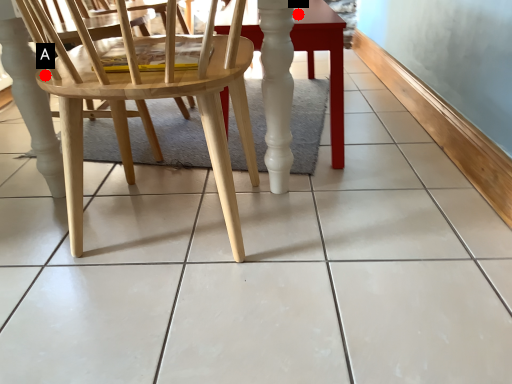
Question: Two points are circled on the image, labeled by A and B beside each circle. Which point appears farthest from the camera in this image?

Choices:
 (A) A is further
 (B) B is further

Answer: (B)